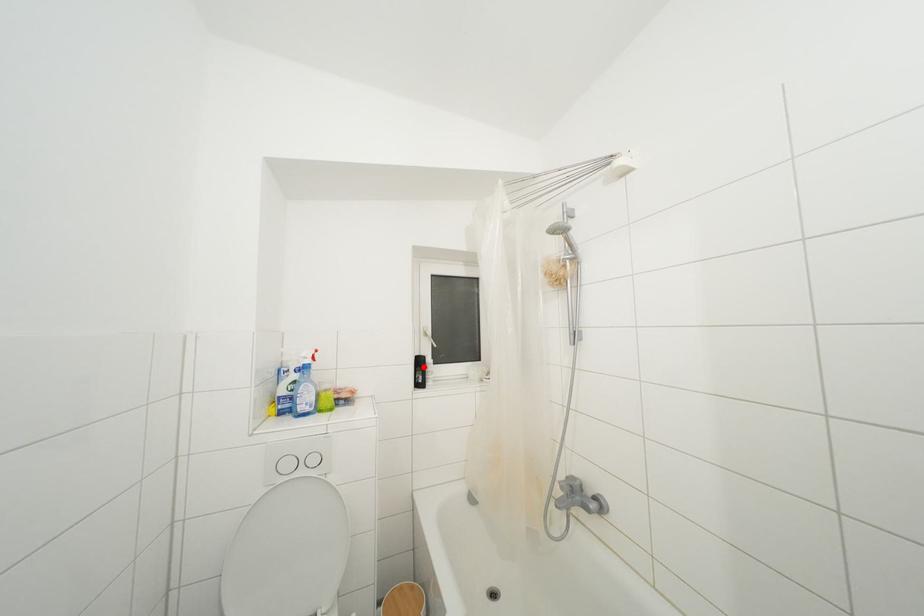
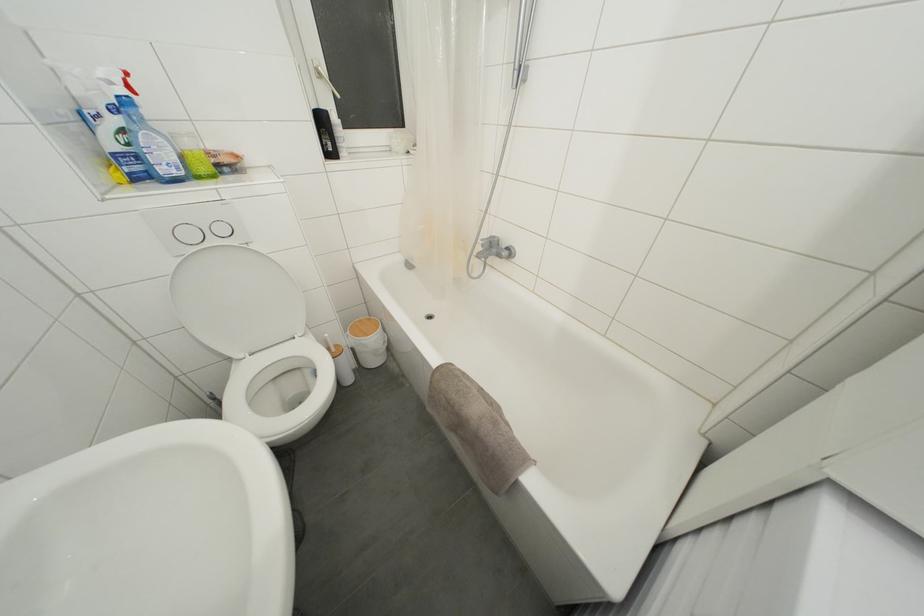
Question: A red point is marked in image1. In image2, is the corresponding 3D point closer to the camera or farther? Reply with the corresponding letter.

Choices:
 (A) The corresponding 3D point is closer.
 (B) The corresponding 3D point is farther.

Answer: (A)